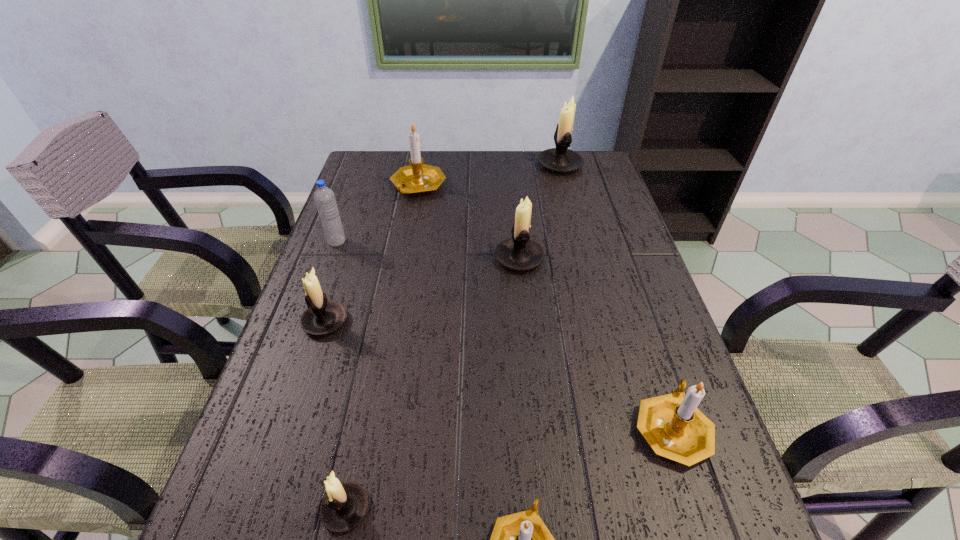
Locate an element on the screen. Image resolution: width=960 pixels, height=540 pixels. the second nearest white candle holder is located at coordinates pyautogui.click(x=323, y=316).

Find the location of a particular element. the second white candle holder from left to right is located at coordinates (345, 505).

You are a GUI agent. You are given a task and a screenshot of the screen. Output one action in this format:
    pyautogui.click(x=<x>, y=<y>)
    Task: Click on the nearest white candle holder
    This screenshot has height=540, width=960.
    Given the screenshot: What is the action you would take?
    pyautogui.click(x=345, y=505)

This screenshot has height=540, width=960. I want to click on vacant space located on the front of the farthest white candle holder, so click(574, 220).

Where is `vacant space located 0.360m on the front of the leftmost gold candle holder`? The width and height of the screenshot is (960, 540). vacant space located 0.360m on the front of the leftmost gold candle holder is located at coordinates (400, 286).

The height and width of the screenshot is (540, 960). I want to click on blank area located on the left of the second white candle holder from right to left, so click(x=476, y=258).

The image size is (960, 540). Identify the location of blank space located 0.060m on the right of the water bottle. (368, 241).

The width and height of the screenshot is (960, 540). Find the location of `vacant space located 0.270m on the left of the fifth farthest candle holder`. vacant space located 0.270m on the left of the fifth farthest candle holder is located at coordinates [491, 428].

Find the location of a particular element. The height and width of the screenshot is (540, 960). free space located on the front of the third biggest white candle holder is located at coordinates (311, 365).

Identify the location of free space located on the left of the second white candle holder from left to right. The image size is (960, 540). (262, 509).